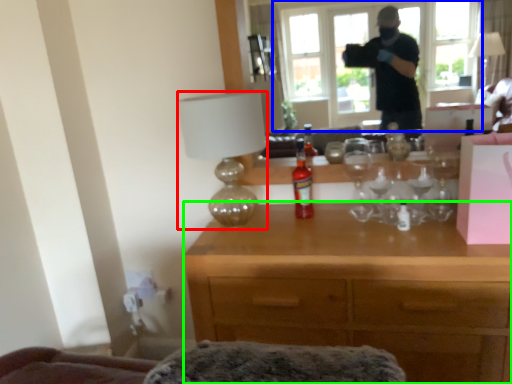
Question: Which object is the closest to the lamp (highlighted by a red box)? Choose among these: window (highlighted by a blue box) or desk (highlighted by a green box).

Choices:
 (A) window
 (B) desk

Answer: (B)